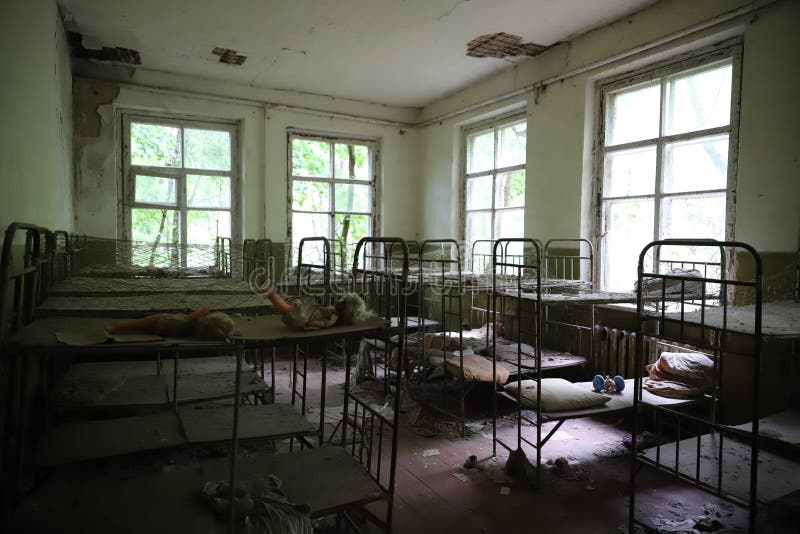
Locate an element on the screen. The image size is (800, 534). wall is located at coordinates (34, 180), (772, 203).